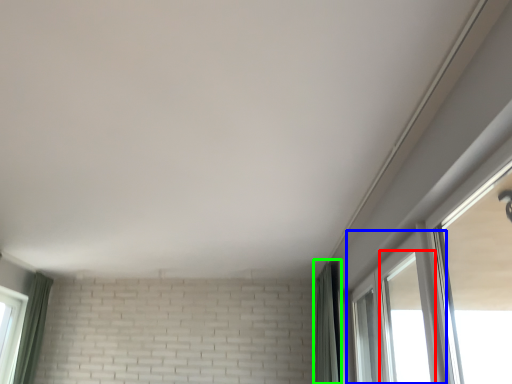
Question: Which object is positioned farthest from window (highlighted by a red box)? Select from window (highlighted by a blue box) and curtain (highlighted by a green box).

Choices:
 (A) window
 (B) curtain

Answer: (A)